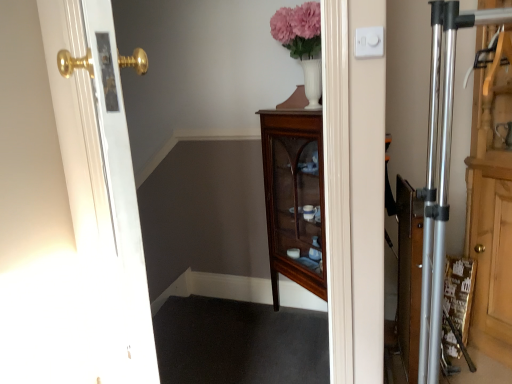
Question: Looking at the image, does wooden dresser at right seem bigger or smaller compared to mahogany glass-front cabinet at center?

Choices:
 (A) big
 (B) small

Answer: (A)

Question: From a real-world perspective, is wooden dresser at right positioned above or below mahogany glass-front cabinet at center?

Choices:
 (A) above
 (B) below

Answer: (A)

Question: Which is nearer to the white plastic/light switch at upper right?

Choices:
 (A) white glossy door at left
 (B) wooden dresser at right
 (C) mahogany glass-front cabinet at center

Answer: (B)

Question: Which of these objects is positioned closest to the wooden dresser at right?

Choices:
 (A) white plastic/light switch at upper right
 (B) white glossy door at left
 (C) mahogany glass-front cabinet at center

Answer: (A)